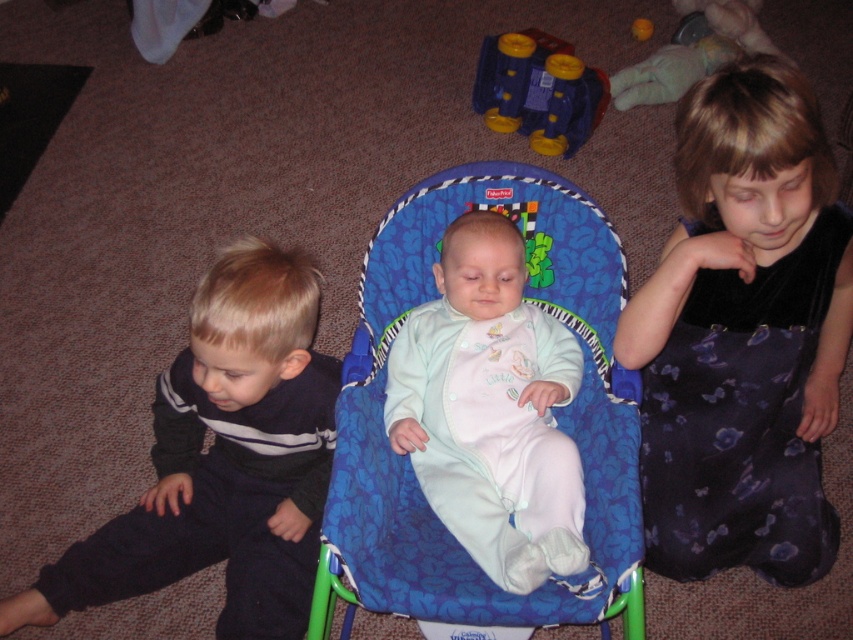
You are a parent trying to choose between the velvet black dress at right and the dark blue fleece pants at left for your child. Based on the size, which one would you pick if you want something that covers more of the child?

The velvet black dress at right has a larger size compared to the dark blue fleece pants at left, so you should choose the velvet black dress at right if you want something that covers more of the child.

You are a parent trying to clean the living room. You see the blue fabric baby chair at center and the light blue soft fabric baby at center. Which object should you move first to access the area behind them?

Result: The blue fabric baby chair at center is in front of the light blue soft fabric baby at center, so you should move the blue fabric baby chair at center first to access the area behind them.

Based on the scene description, where is the dark blue fleece pants at left located in terms of coordinates?

The dark blue fleece pants at left is located at point (223, 460).